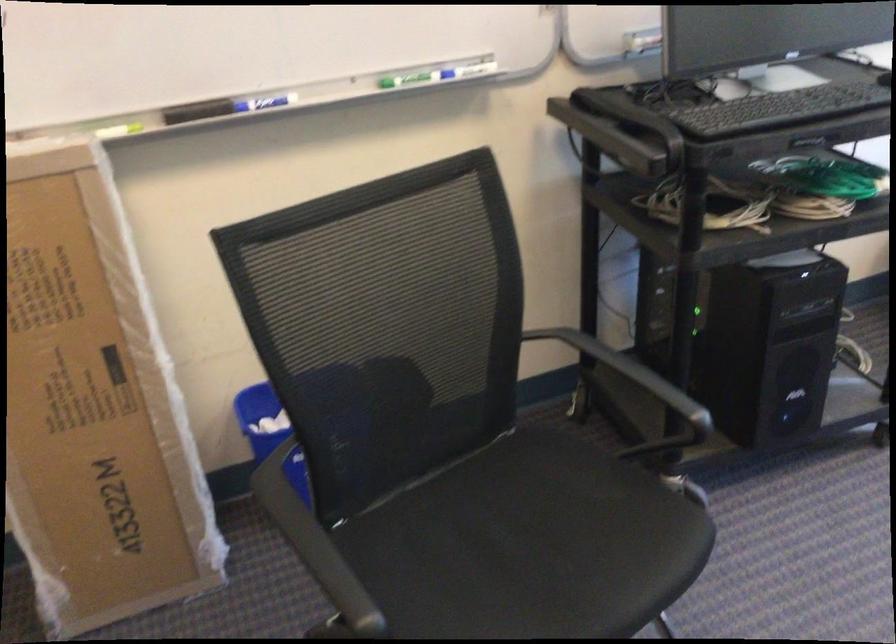
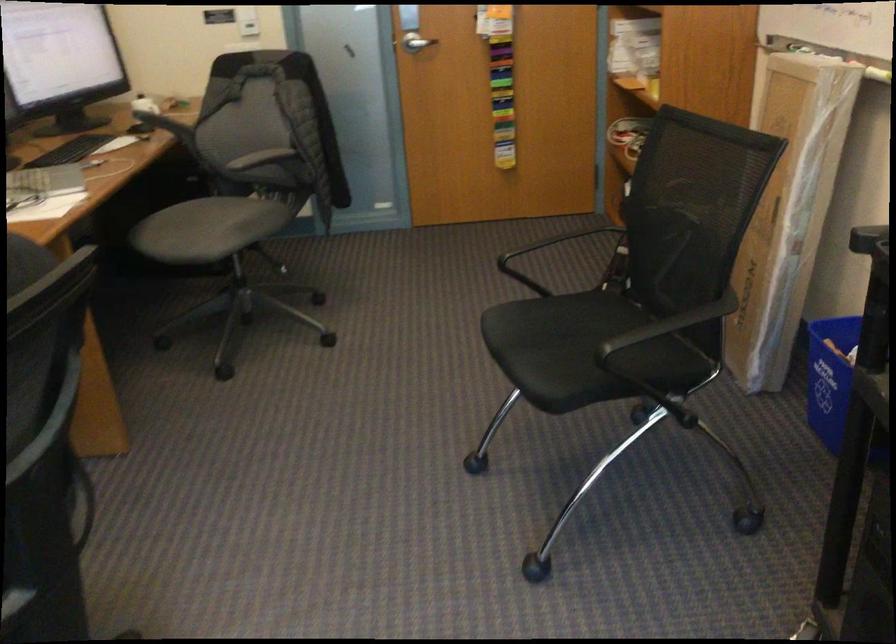
The point at (497, 540) is marked in the first image. Where is the corresponding point in the second image?

(583, 351)